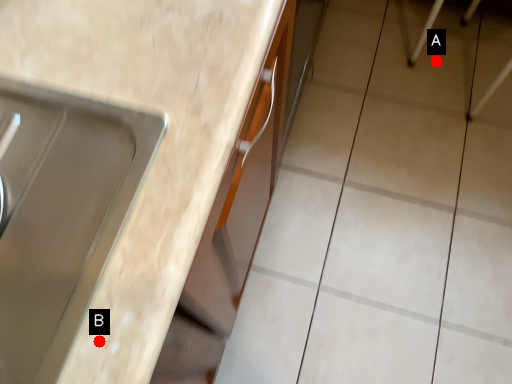
Question: Two points are circled on the image, labeled by A and B beside each circle. Which point is closer to the camera taking this photo?

Choices:
 (A) A is closer
 (B) B is closer

Answer: (B)